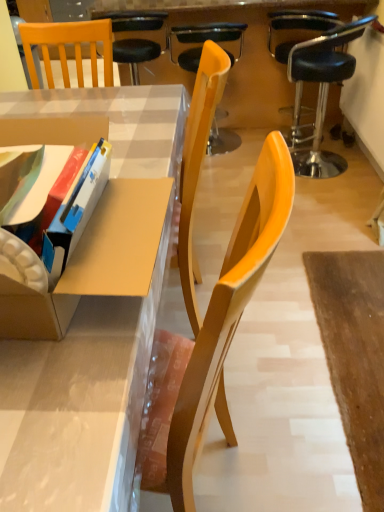
Question: Considering the relative sizes of black leather stool at upper right, the 1th chair when ordered from right to left, and cardboard box at left in the image provided, is black leather stool at upper right, the 1th chair when ordered from right to left, thinner than cardboard box at left?

Choices:
 (A) yes
 (B) no

Answer: (A)

Question: Does black leather stool at upper right, the 1th chair when ordered from right to left, appear on the left side of cardboard box at left?

Choices:
 (A) yes
 (B) no

Answer: (B)

Question: Is there a large distance between black leather stool at upper right, the 1th chair when ordered from right to left, and cardboard box at left?

Choices:
 (A) yes
 (B) no

Answer: (A)

Question: From the image's perspective, is black leather stool at upper right, the 1th chair when ordered from right to left, located beneath cardboard box at left?

Choices:
 (A) yes
 (B) no

Answer: (B)

Question: Can you confirm if black leather stool at upper right, the 1th chair when ordered from right to left, is taller than cardboard box at left?

Choices:
 (A) yes
 (B) no

Answer: (B)

Question: Considering the relative sizes of black leather stool at upper right, the 1th chair when ordered from right to left, and cardboard box at left in the image provided, is black leather stool at upper right, the 1th chair when ordered from right to left, shorter than cardboard box at left?

Choices:
 (A) no
 (B) yes

Answer: (B)

Question: Is black leather stool at upper right, the 1th chair when ordered from right to left, aimed at wooden chair at center, which is the second chair in left-to-right order?

Choices:
 (A) no
 (B) yes

Answer: (A)

Question: Is black leather stool at upper right, the 1th chair when ordered from right to left, placed right next to wooden chair at center, which is the second chair in left-to-right order?

Choices:
 (A) no
 (B) yes

Answer: (A)

Question: Can you confirm if black leather stool at upper right, the 1th chair when ordered from right to left, is smaller than wooden chair at center, which is the second chair in left-to-right order?

Choices:
 (A) yes
 (B) no

Answer: (B)

Question: Is black leather stool at upper right, the 1th chair when ordered from right to left, to the left of wooden chair at center, which is the second chair in left-to-right order, from the viewer's perspective?

Choices:
 (A) no
 (B) yes

Answer: (A)

Question: Is black leather stool at upper right, the third chair viewed from the left, shorter than wooden chair at center, the 2th chair positioned from the right?

Choices:
 (A) no
 (B) yes

Answer: (A)

Question: Is black leather stool at upper right, the 1th chair when ordered from right to left, outside of wooden chair at center, the 2th chair positioned from the right?

Choices:
 (A) yes
 (B) no

Answer: (A)

Question: Is the position of wooden chair at center, the 2th chair positioned from the right, more distant than that of matte plastic desk at center?

Choices:
 (A) yes
 (B) no

Answer: (A)